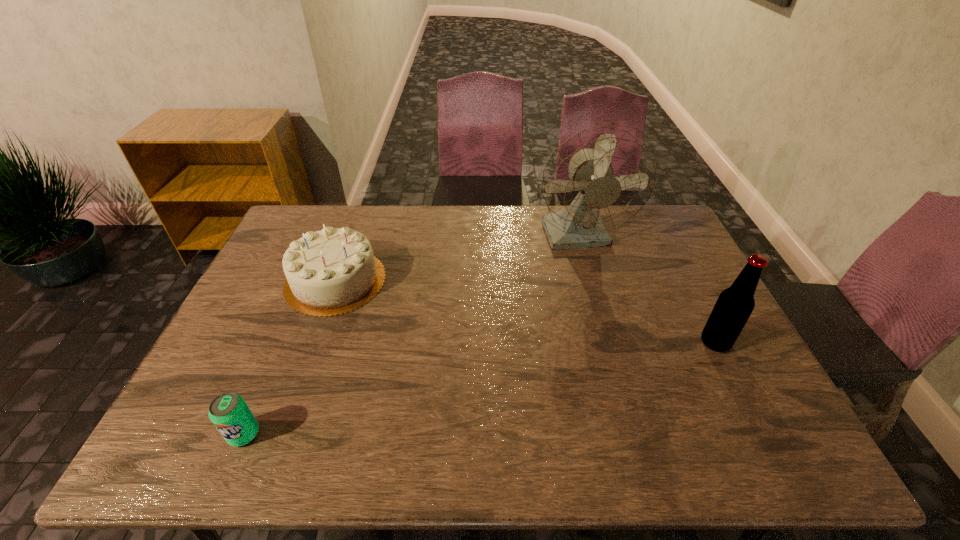
Locate an element on the screen. The height and width of the screenshot is (540, 960). free space between the second tallest object and the shortest object is located at coordinates (479, 388).

Where is `vacant area that lies between the shortest object and the birthday cake`? vacant area that lies between the shortest object and the birthday cake is located at coordinates (290, 357).

The height and width of the screenshot is (540, 960). In order to click on vacant area between the third object from left to right and the birthday cake in this screenshot , I will do `click(458, 259)`.

Where is `empty location between the third object from left to right and the birthday cake`? This screenshot has width=960, height=540. empty location between the third object from left to right and the birthday cake is located at coordinates (458, 259).

I want to click on free spot between the second tallest object and the birthday cake, so click(x=525, y=312).

Where is `empty location between the third tallest object and the third object from left to right`? This screenshot has width=960, height=540. empty location between the third tallest object and the third object from left to right is located at coordinates (458, 259).

This screenshot has height=540, width=960. I want to click on free space between the second tallest object and the birthday cake, so click(x=525, y=312).

I want to click on vacant area that lies between the shortest object and the rightmost object, so click(x=479, y=388).

Locate an element on the screen. The width and height of the screenshot is (960, 540). vacant point located between the second shortest object and the beer bottle is located at coordinates (525, 312).

Locate an element on the screen. vacant area that lies between the third shortest object and the birthday cake is located at coordinates (525, 312).